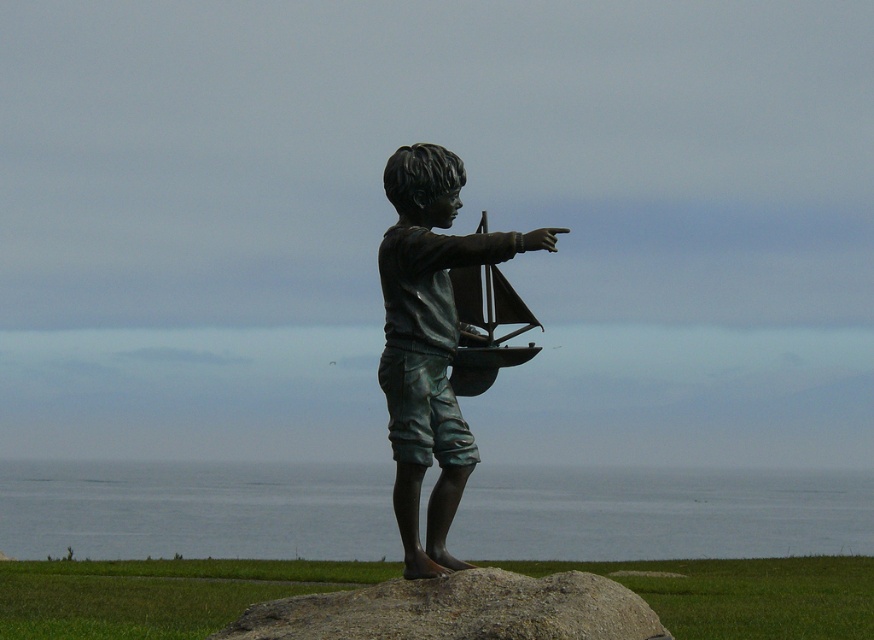
Between bronze statue of boy pointing at center and gray granite rock at center, which one has more height?

Standing taller between the two is bronze statue of boy pointing at center.

Is bronze statue of boy pointing at center further to the viewer compared to gray granite rock at center?

Yes, bronze statue of boy pointing at center is behind gray granite rock at center.

Which is in front, point (390, 348) or point (494, 608)?

Point (494, 608) is in front.

You are a GUI agent. You are given a task and a screenshot of the screen. Output one action in this format:
    pyautogui.click(x=<x>, y=<y>)
    Task: Click on the bronze statue of boy pointing at center
    This screenshot has width=874, height=640.
    Given the screenshot: What is the action you would take?
    pyautogui.click(x=429, y=340)

Is gray water at lower center positioned in front of bronze statue of boy pointing at center?

No.

Can you confirm if gray water at lower center is positioned to the left of bronze statue of boy pointing at center?

No, gray water at lower center is not to the left of bronze statue of boy pointing at center.

Image resolution: width=874 pixels, height=640 pixels. Describe the element at coordinates (196, 509) in the screenshot. I see `gray water at lower center` at that location.

The width and height of the screenshot is (874, 640). I want to click on gray water at lower center, so click(x=196, y=509).

Which is in front, point (718, 528) or point (370, 600)?

Point (370, 600) is more forward.

Who is shorter, gray water at lower center or gray granite rock at center?

gray granite rock at center is shorter.

At what (x,y) coordinates should I click in order to perform the action: click on gray water at lower center. Please return your answer as a coordinate pair (x, y). The height and width of the screenshot is (640, 874). Looking at the image, I should click on (196, 509).